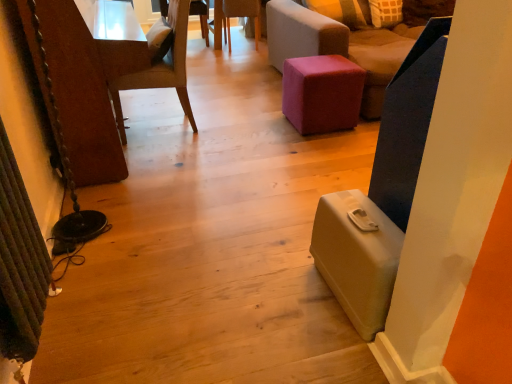
Where is `free point to the right of light brown wood chair at left, placed as the 2th chair when sorted from left to right`? The image size is (512, 384). free point to the right of light brown wood chair at left, placed as the 2th chair when sorted from left to right is located at coordinates (229, 127).